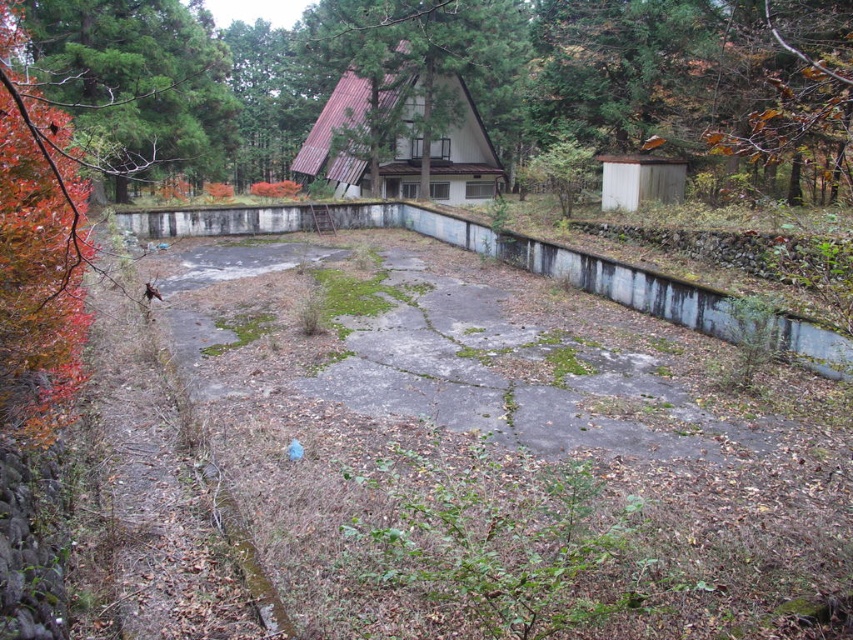
Question: Can you confirm if metallic brown roof at upper center is thinner than reddish-brown bark tree at left?

Choices:
 (A) yes
 (B) no

Answer: (B)

Question: Which point is farther to the camera?

Choices:
 (A) (318, 173)
 (B) (70, 61)

Answer: (A)

Question: Is metallic brown roof at upper center to the left of reddish-brown bark tree at left from the viewer's perspective?

Choices:
 (A) yes
 (B) no

Answer: (B)

Question: Is the position of metallic brown roof at upper center more distant than that of reddish-brown bark tree at left?

Choices:
 (A) no
 (B) yes

Answer: (B)